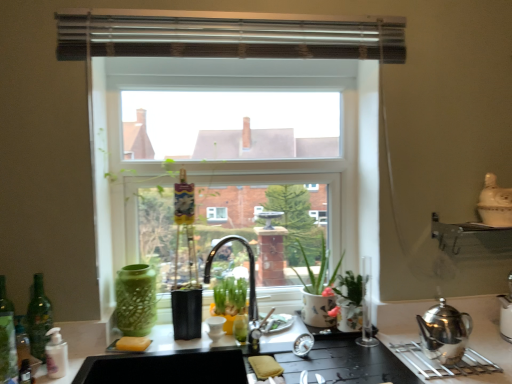
Where is `free space above polished stainless steel kettle at lower right (from a real-world perspective)`? This screenshot has width=512, height=384. free space above polished stainless steel kettle at lower right (from a real-world perspective) is located at coordinates (435, 351).